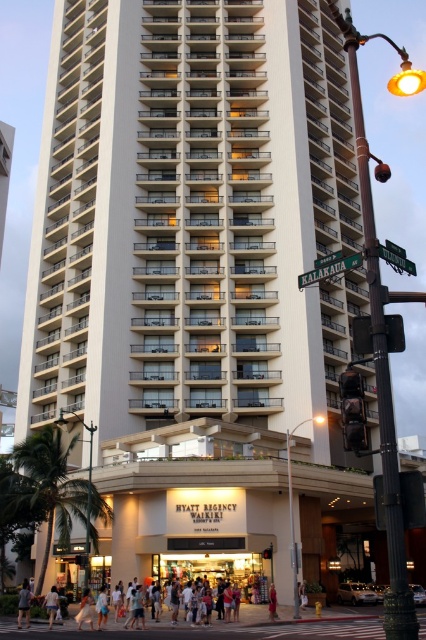
You are a photographer standing in front of the Hyatt Regency Waikiki Resort. You notice two people in the scene, one wearing light blue denim shorts at lower left and another wearing a red fabric dress at lower center. Which person is closer to the ground?

The light blue denim shorts at lower left is positioned under the red fabric dress at lower center, meaning the person wearing the light blue denim shorts at lower left is closer to the ground.

Based on the photo, you are a photographer standing in front of the Hyatt Regency Waikiki Resort. You notice two people in the scene. One is wearing light blue denim shorts at lower left and the other is wearing a red fabric dress at lower center. Which of these two is positioned more to the left side of the frame?

The light blue denim shorts at lower left is positioned more to the left side of the frame compared to the red fabric dress at lower center.